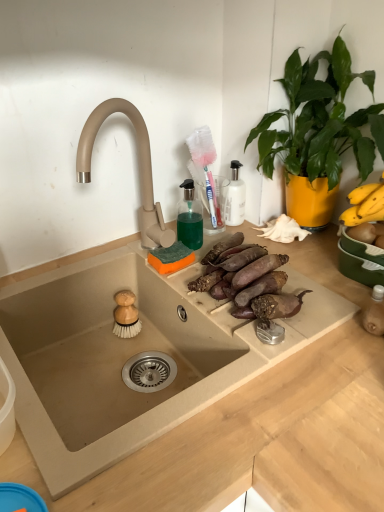
Find the location of a particular element. vacant area to the right of brown rough sweet potatoes at center is located at coordinates (318, 295).